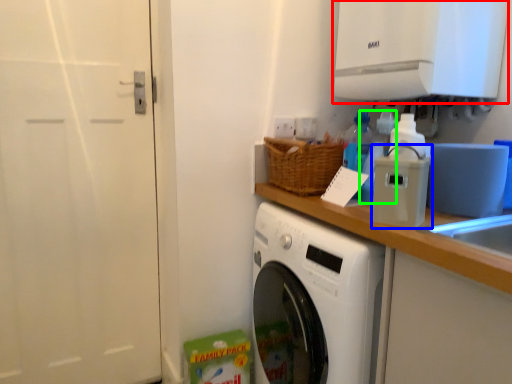
Question: Which object is positioned farthest from exhaust hood (highlighted by a red box)? Select from appliance (highlighted by a blue box) and bottle (highlighted by a green box).

Choices:
 (A) appliance
 (B) bottle

Answer: (A)